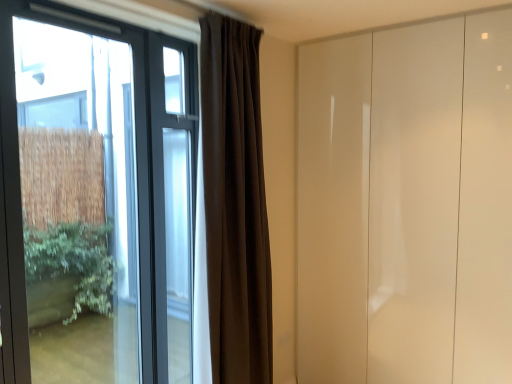
Question: Considering the relative positions of clear glass window at left and glossy white door at right in the image provided, is clear glass window at left to the left or to the right of glossy white door at right?

Choices:
 (A) right
 (B) left

Answer: (B)

Question: From a real-world perspective, is clear glass window at left positioned above or below glossy white door at right?

Choices:
 (A) above
 (B) below

Answer: (A)

Question: Estimate the real-world distances between objects in this image. Which object is farther from the dark matte curtain at center?

Choices:
 (A) clear glass window at left
 (B) glossy white door at right

Answer: (A)

Question: Considering the real-world distances, which object is closest to the glossy white door at right?

Choices:
 (A) clear glass window at left
 (B) dark matte curtain at center

Answer: (B)